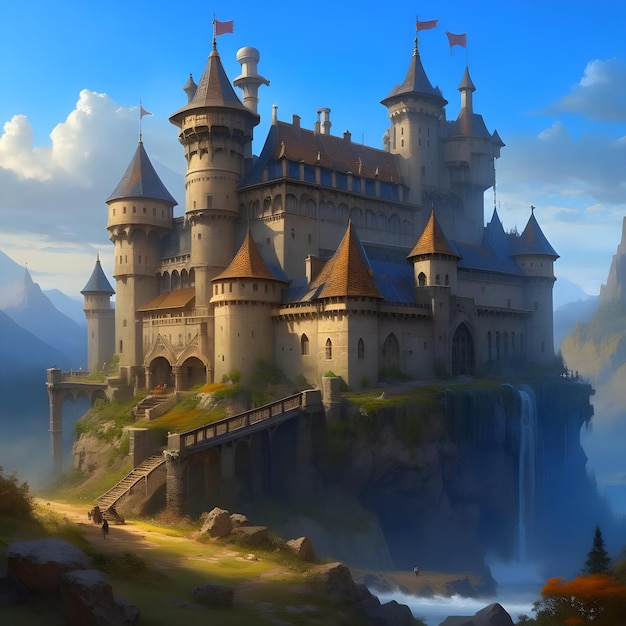
This screenshot has height=626, width=626. Find the location of `foam`. foam is located at coordinates (401, 596), (442, 603), (459, 603).